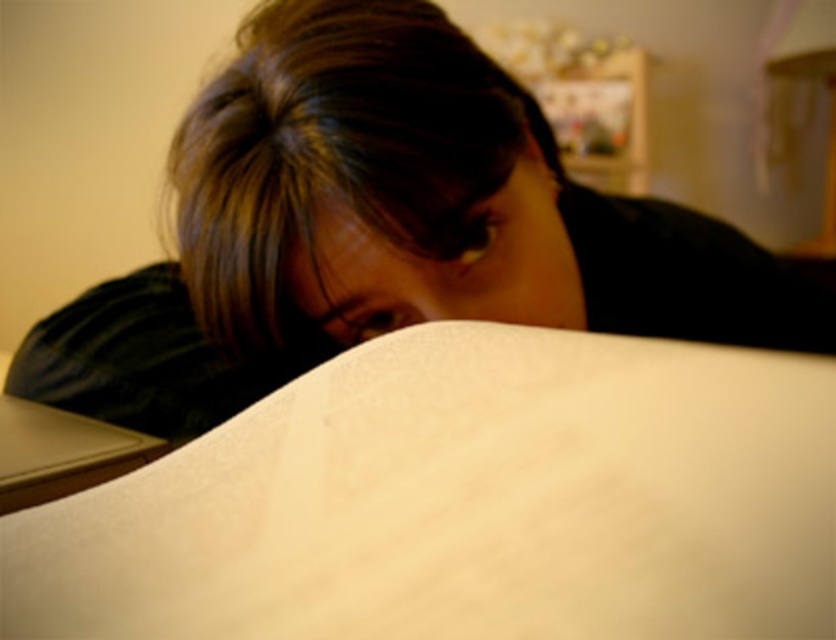
You are an office worker who needs to reach the black matte laptop at lower left without moving from your current position. The matte black hair at upper center is in the way. Is the laptop within arm reach?

The matte black hair at upper center is 20.99 centimeters away from the black matte laptop at lower left. Since the distance is relatively short, the laptop is likely within arm reach, but the hair may obstruct access unless moved aside.

You are a delivery robot with a package that is 12 inches wide. You need to place it on the surface where the white matte blanket at lower center and black matte laptop at lower left are located. Can you fit the package between them without moving either object?

The white matte blanket at lower center and black matte laptop at lower left are 11.96 inches apart, so the package which is 12 inches wide cannot fit between them without moving either object since the space is slightly narrower.

In the scene shown: You are an artist trying to replicate the scene. The point at coordinates point (x=371, y=221) is crucial for positioning elements. Where should you place this point in your drawing?

The point at coordinates point (x=371, y=221) should be placed at the upper center of the drawing to mark the location of the matte black hair at upper center.